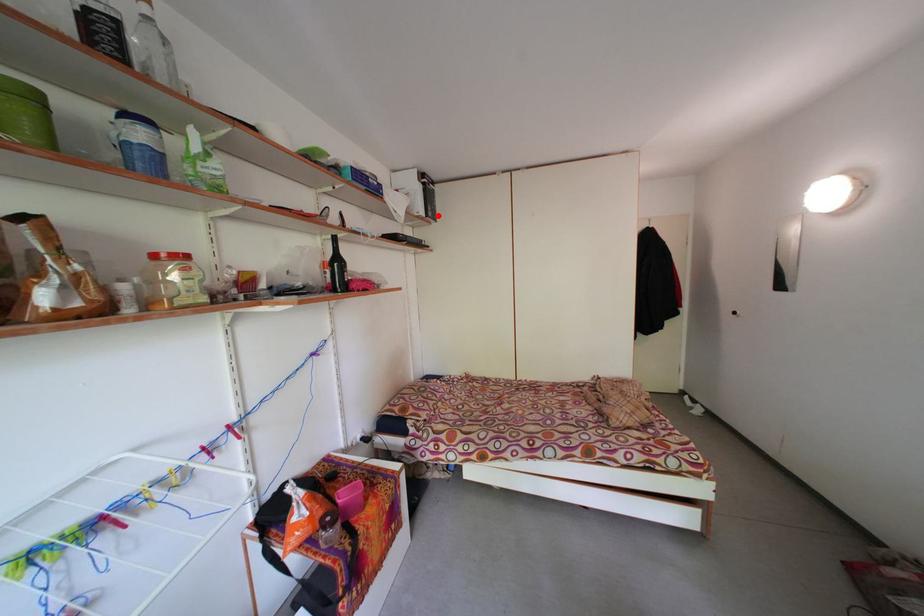
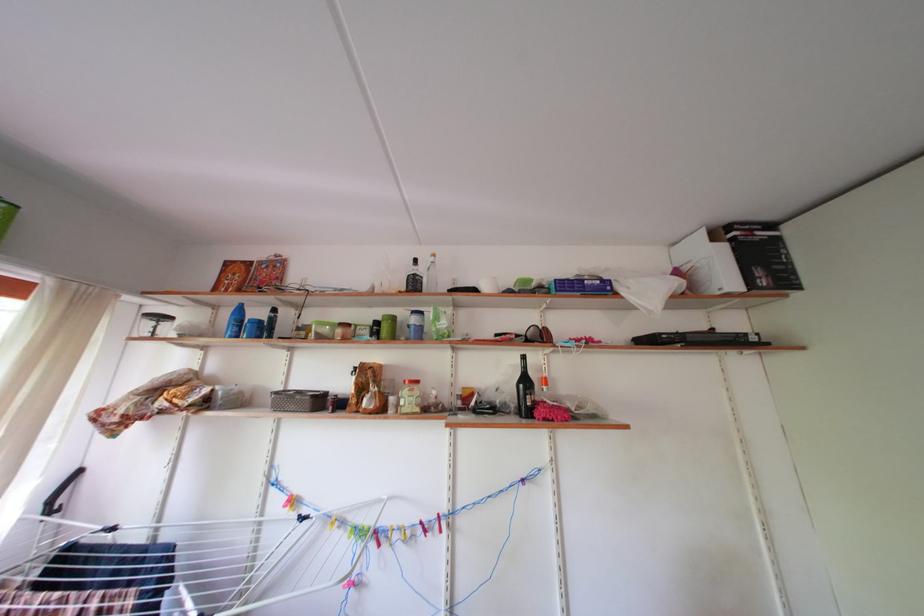
In the second image, find the point that corresponds to the highlighted location in the first image.

(768, 278)